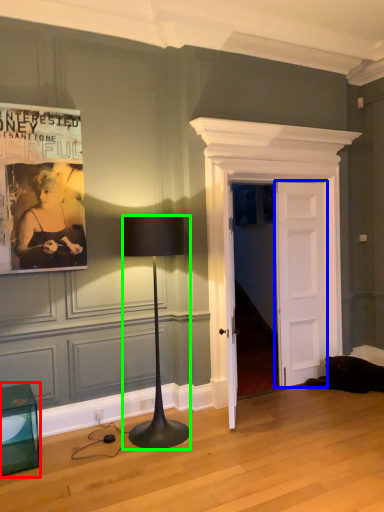
Question: Which is farther away from furniture (highlighted by a red box)? door (highlighted by a blue box) or lamp (highlighted by a green box)?

Choices:
 (A) door
 (B) lamp

Answer: (A)